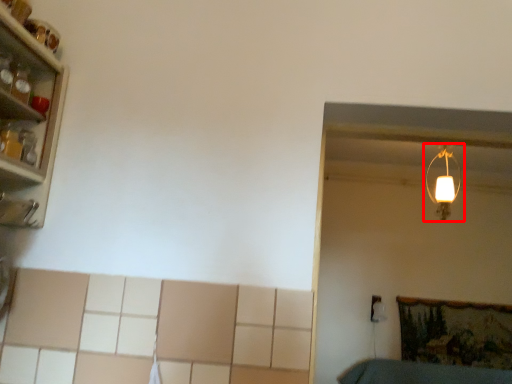
Question: From the image's perspective, where is lamp (annotated by the red box) located relative to shelf?

Choices:
 (A) above
 (B) below

Answer: (B)